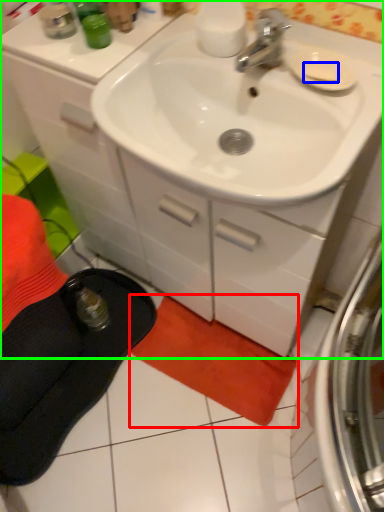
Question: Estimate the real-world distances between objects in this image. Which object is closer to beach towel (highlighted by a red box), soap (highlighted by a blue box) or bathroom cabinet (highlighted by a green box)?

Choices:
 (A) soap
 (B) bathroom cabinet

Answer: (B)